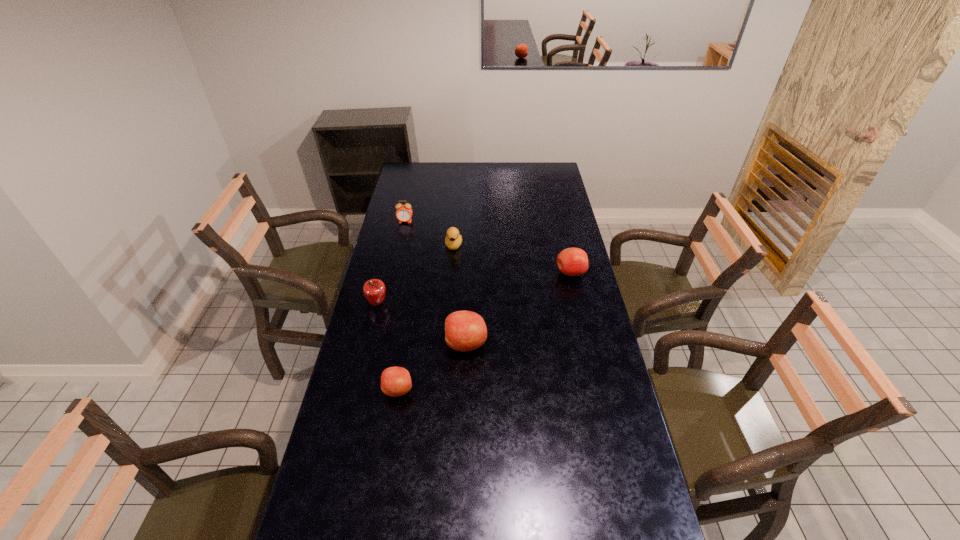
Where is `free space located on the left of the shortest apple`? This screenshot has width=960, height=540. free space located on the left of the shortest apple is located at coordinates (362, 390).

Image resolution: width=960 pixels, height=540 pixels. I want to click on blank space located on the back of the tallest apple, so click(x=468, y=265).

I want to click on vacant space situated 0.260m on the left of the rightmost apple, so click(x=494, y=273).

Identify the location of vacant area situated 0.360m on the back of the leftmost apple. (392, 241).

Identify the location of free spot located 0.360m facing forward on the second farthest object. (449, 312).

At what (x,y) coordinates should I click in order to perform the action: click on vacant space located on the face of the farthest object. Please return your answer as a coordinate pair (x, y). Looking at the image, I should click on (396, 268).

This screenshot has height=540, width=960. I want to click on alarm clock positioned at the left edge, so click(404, 212).

The width and height of the screenshot is (960, 540). Identify the location of object that is at the right edge. (572, 261).

You are a GUI agent. You are given a task and a screenshot of the screen. Output one action in this format:
    pyautogui.click(x=<x>, y=<y>)
    Task: Click on the free space at the far edge of the desktop
    This screenshot has height=540, width=960.
    Given the screenshot: What is the action you would take?
    pyautogui.click(x=515, y=164)

Identify the location of vacant area at the near edge. This screenshot has width=960, height=540. (587, 517).